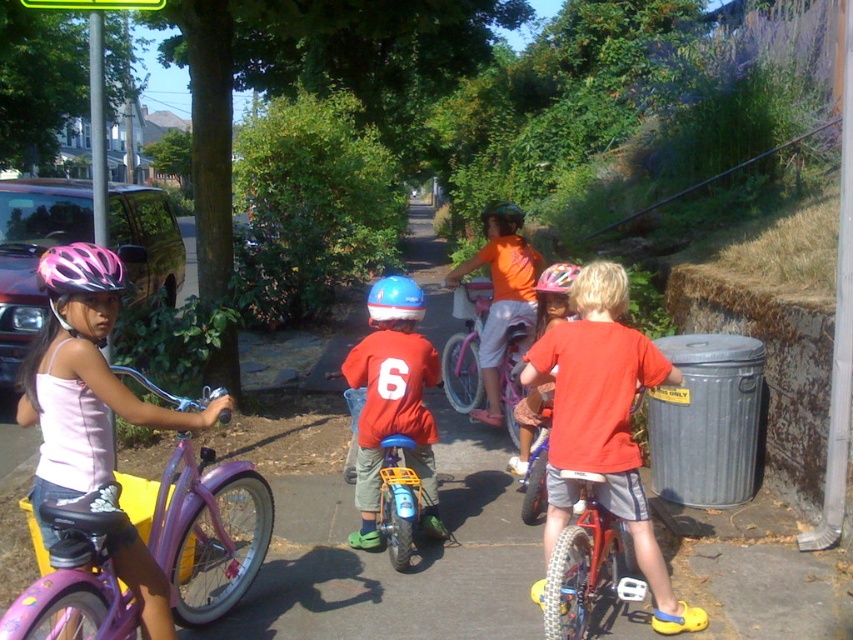
You are a delivery robot with a 5 feet wide package. You need to pass between the blue matte helmet at center and the pink matte bicycle helmet at center. Can you fit through the space between them?

The distance between the blue matte helmet at center and the pink matte bicycle helmet at center is 4.99 feet, which is just under 5 feet. Therefore, the 5 feet wide package might not fit comfortably through the space between them. You should consider an alternative route or check for a slightly wider gap.

You are a parent trying to determine if your child can safely place their blue matte helmet at center on the seat of the matte red bicycle at center. Based on the height of the helmet and the bicycle, is this possible?

The matte red bicycle at center has a greater height compared to the blue matte helmet at center. Since the bicycle is taller than the helmet, the helmet can be safely placed on the seat without any issues.

You are a delivery robot that needs to place a package between the matte red bicycle at center and the blue matte helmet at center. The package requires 30 inches of space. Can you fit it there?

The distance between the matte red bicycle at center and the blue matte helmet at center is 32.31 inches, which is more than enough to accommodate the 30 inches required for the package. Yes, you can fit the package there.